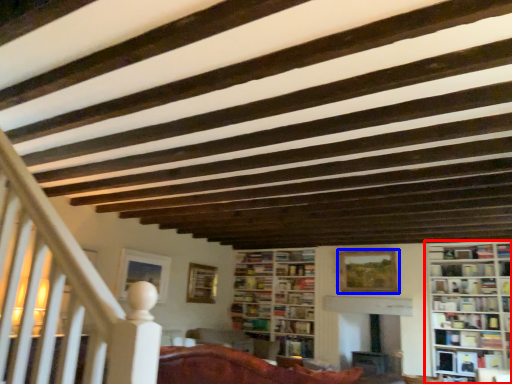
Question: Which of the following is the closest to the observer, bookcase (highlighted by a red box) or picture frame (highlighted by a blue box)?

Choices:
 (A) bookcase
 (B) picture frame

Answer: (A)